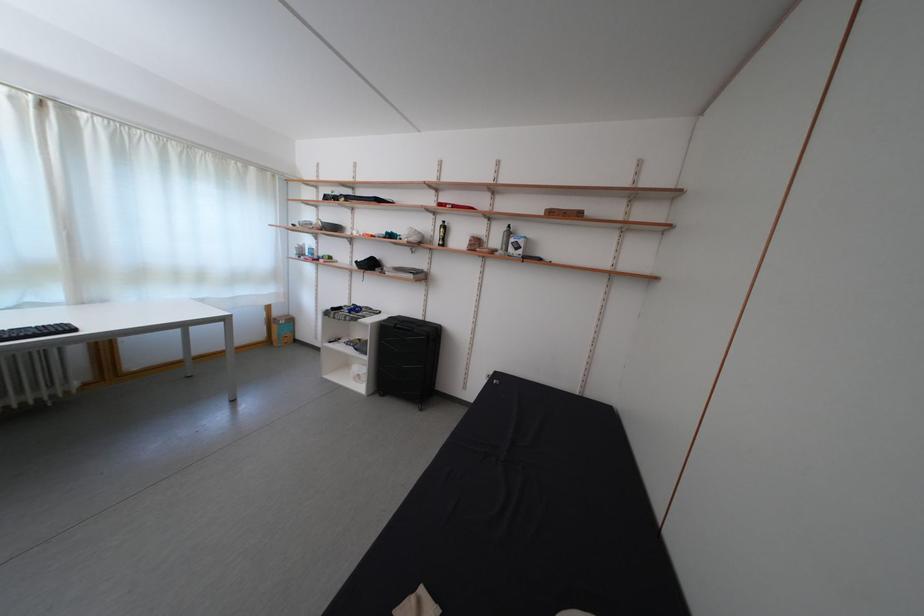
Find where to lift the black bottle. Please return your answer as a coordinate pair (x, y).

(442, 233)